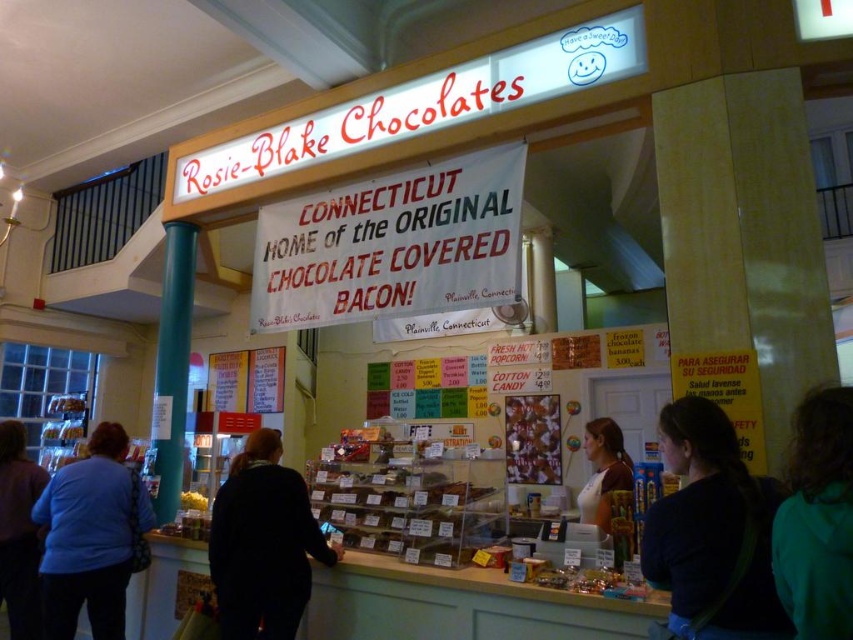
Who is more forward, (820, 627) or (21, 504)?

Point (820, 627)

Who is shorter, dark green hoodie at lower right or dark blue sweater at lower left?

dark green hoodie at lower right

What do you see at coordinates (817, 518) in the screenshot?
I see `dark green hoodie at lower right` at bounding box center [817, 518].

Locate an element on the screen. dark green hoodie at lower right is located at coordinates (817, 518).

Who is more forward, (428, 516) or (90, 483)?

Positioned in front is point (428, 516).

From the picture: Between translucent plastic chocolate at center and blue fabric shirt at lower left, which one appears on the left side from the viewer's perspective?

Positioned to the left is blue fabric shirt at lower left.

Is point (431, 467) more distant than point (59, 524)?

Yes, point (431, 467) is farther from viewer.

The image size is (853, 640). I want to click on translucent plastic chocolate at center, so click(x=408, y=497).

Can you confirm if dark blue fabric at center is wider than blue fabric shirt at lower left?

Incorrect, dark blue fabric at center's width does not surpass blue fabric shirt at lower left's.

The image size is (853, 640). What are the coordinates of `dark blue fabric at center` in the screenshot? It's located at (712, 529).